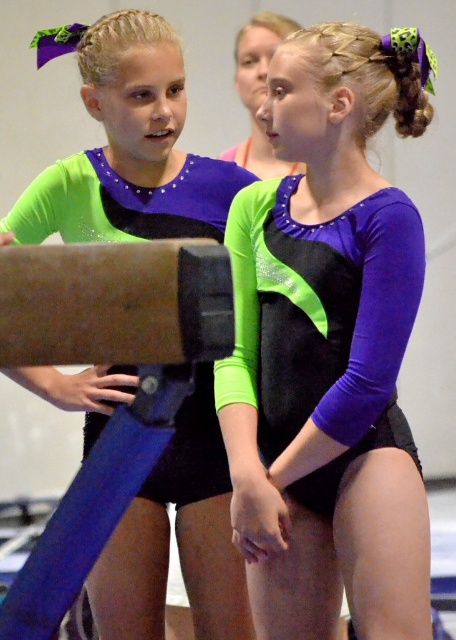
Question: Does purple matte leotard at center appear over matte black leotard at center?

Choices:
 (A) yes
 (B) no

Answer: (A)

Question: Does purple matte leotard at center have a smaller size compared to matte black leotard at center?

Choices:
 (A) yes
 (B) no

Answer: (B)

Question: Which of the following is the farthest from the observer?

Choices:
 (A) (399, 276)
 (B) (9, 268)
 (C) (145, 598)

Answer: (C)

Question: Which point appears farthest from the camera in this image?

Choices:
 (A) pos(122,298)
 (B) pos(165,552)

Answer: (B)

Question: Based on their relative distances, which object is farther from the purple matte leotard at center?

Choices:
 (A) brown cardboard beam at center
 (B) matte black leotard at center

Answer: (A)

Question: From the image, what is the correct spatial relationship of matte black leotard at center in relation to brown cardboard beam at center?

Choices:
 (A) above
 (B) below

Answer: (B)